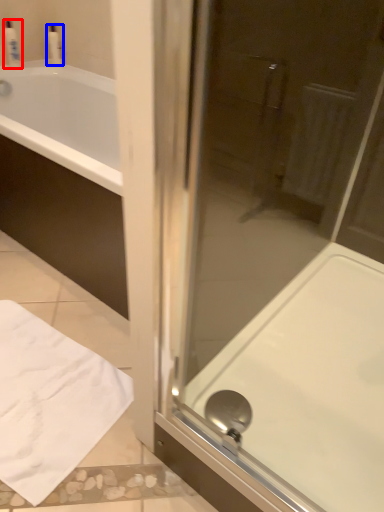
Question: Among these objects, which one is nearest to the camera, toiletry (highlighted by a red box) or toiletry (highlighted by a blue box)?

Choices:
 (A) toiletry
 (B) toiletry

Answer: (A)